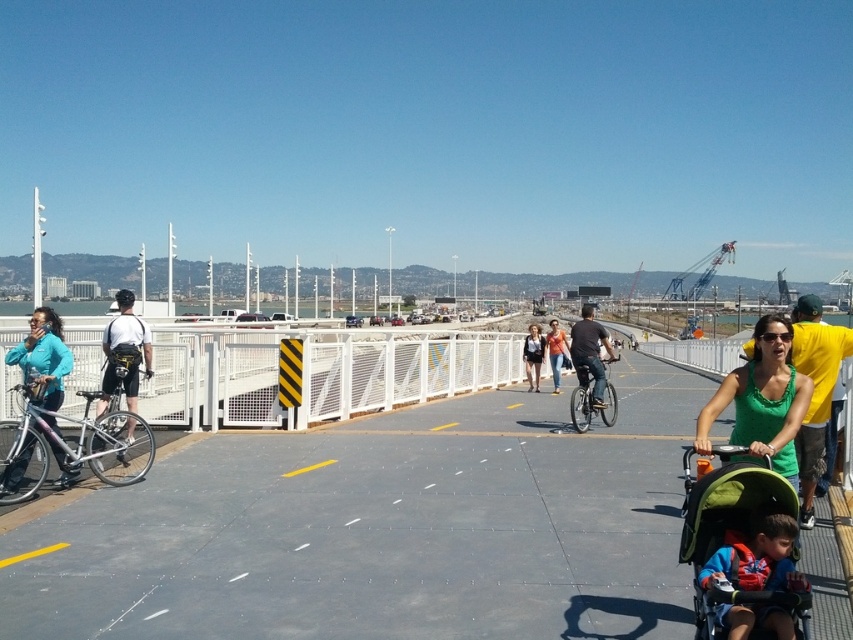
You are a pedestrian trying to cross the path. The path has a matte black bicycle at center and a silver metallic bicycle at center. Which bicycle should you avoid to stay within the yellow lines?

The matte black bicycle at center might be wider than silver metallic bicycle at center, so you should avoid the matte black bicycle at center to stay within the yellow lines.

You are a delivery person who needs to choose between the matte black bicycle at center and the silver metallic bicycle at center for a quick delivery. Which bicycle should you choose based on their sizes?

The matte black bicycle at center is larger in size than the silver metallic bicycle at center, so you should choose the silver metallic bicycle at center because it is smaller and easier to maneuver for quick deliveries.

You are a delivery person riding a matte black bicycle at left on a gray concrete path at center. You need to make a left turn onto a side street. Which side of the path should you move to in order to prepare for the turn?

The gray concrete path at center is positioned on the right side of matte black bicycle at left. To prepare for a left turn, you should move to the left side of the path, which is closer to the white metal fence on the left side of the path.